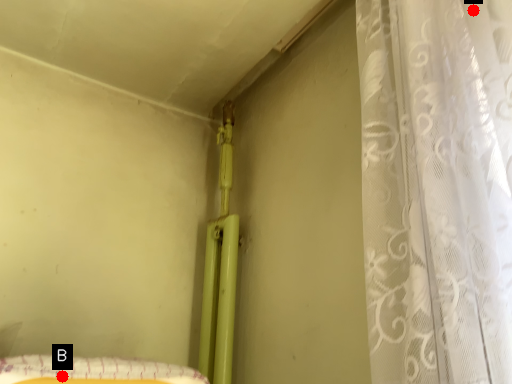
Question: Two points are circled on the image, labeled by A and B beside each circle. Among these points, which one is nearest to the camera?

Choices:
 (A) A is closer
 (B) B is closer

Answer: (B)